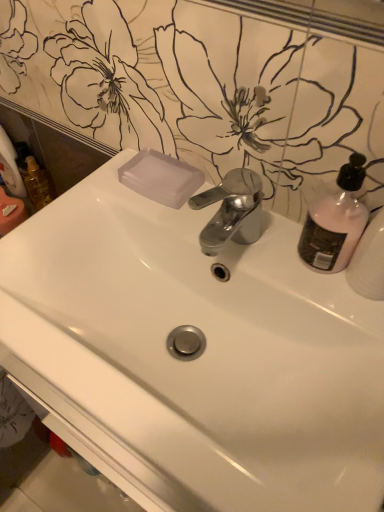
Locate an element on the screen. The width and height of the screenshot is (384, 512). vacant space positioned to the left of translucent plastic soap at upper center is located at coordinates (91, 194).